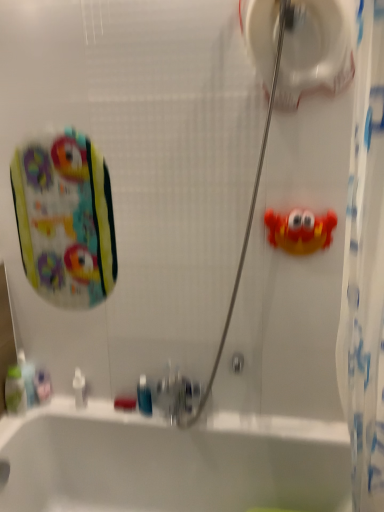
Question: Can you confirm if white plastic bottle at lower left is smaller than green plastic mouthwash at lower left, which is the 4th mouthwash in right-to-left order?

Choices:
 (A) no
 (B) yes

Answer: (B)

Question: From the image's perspective, does white plastic bottle at lower left appear lower than green plastic mouthwash at lower left, which is the 4th mouthwash in right-to-left order?

Choices:
 (A) no
 (B) yes

Answer: (B)

Question: Considering the relative sizes of white plastic bottle at lower left and green plastic mouthwash at lower left, which is the 4th mouthwash in right-to-left order, in the image provided, is white plastic bottle at lower left taller than green plastic mouthwash at lower left, which is the 4th mouthwash in right-to-left order,?

Choices:
 (A) yes
 (B) no

Answer: (B)

Question: Is white plastic bottle at lower left to the right of green plastic mouthwash at lower left, which is the first mouthwash from left to right, from the viewer's perspective?

Choices:
 (A) no
 (B) yes

Answer: (B)

Question: Can you confirm if white plastic bottle at lower left is shorter than green plastic mouthwash at lower left, which is the first mouthwash from left to right?

Choices:
 (A) yes
 (B) no

Answer: (A)

Question: Is the depth of white plastic bottle at lower left greater than that of green plastic mouthwash at lower left, which is the first mouthwash from left to right?

Choices:
 (A) yes
 (B) no

Answer: (A)

Question: Could you tell me if white glossy toilet paper at upper center is facing green plastic mouthwash at lower left, which is the 4th mouthwash in right-to-left order?

Choices:
 (A) no
 (B) yes

Answer: (A)

Question: From the image's perspective, is white glossy toilet paper at upper center below green plastic mouthwash at lower left, which is the 4th mouthwash in right-to-left order?

Choices:
 (A) yes
 (B) no

Answer: (B)

Question: Would you say white glossy toilet paper at upper center is outside green plastic mouthwash at lower left, which is the 4th mouthwash in right-to-left order?

Choices:
 (A) yes
 (B) no

Answer: (A)

Question: Is white glossy toilet paper at upper center next to green plastic mouthwash at lower left, which is the 4th mouthwash in right-to-left order, and touching it?

Choices:
 (A) yes
 (B) no

Answer: (B)

Question: Can you confirm if white glossy toilet paper at upper center is shorter than green plastic mouthwash at lower left, which is the 4th mouthwash in right-to-left order?

Choices:
 (A) no
 (B) yes

Answer: (A)

Question: Considering the relative positions of white glossy toilet paper at upper center and green plastic mouthwash at lower left, which is the first mouthwash from left to right, in the image provided, is white glossy toilet paper at upper center behind green plastic mouthwash at lower left, which is the first mouthwash from left to right,?

Choices:
 (A) yes
 (B) no

Answer: (B)

Question: Does rubber crab at right have a smaller size compared to white glossy bathtub at lower center?

Choices:
 (A) yes
 (B) no

Answer: (A)